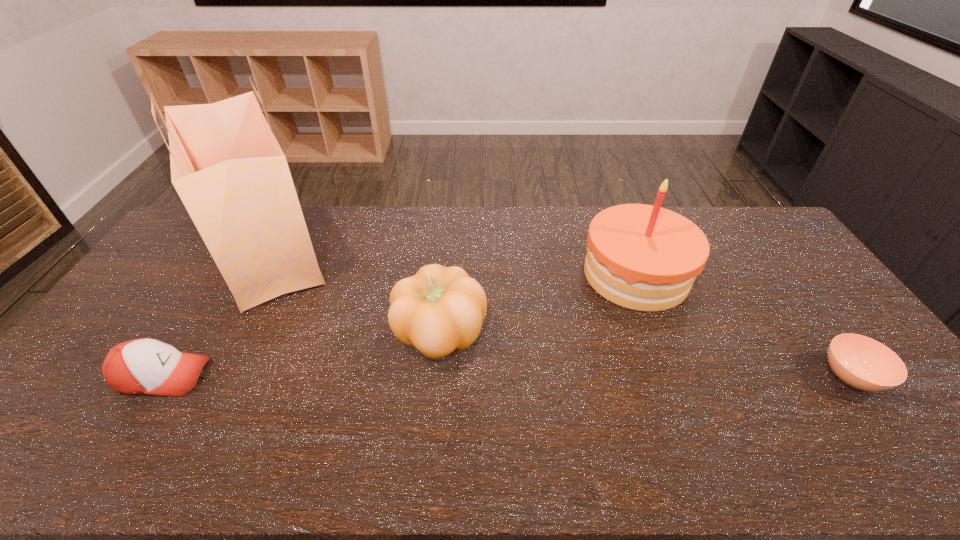
Locate an element on the screen. The image size is (960, 540). the tallest object is located at coordinates (227, 167).

The image size is (960, 540). Find the location of `birthday cake`. birthday cake is located at coordinates (642, 257).

You are a GUI agent. You are given a task and a screenshot of the screen. Output one action in this format:
    pyautogui.click(x=<x>, y=<y>)
    Task: Click on the fourth object from left to right
    Image resolution: width=960 pixels, height=540 pixels.
    Given the screenshot: What is the action you would take?
    pyautogui.click(x=642, y=257)

At what (x,y) coordinates should I click in order to perform the action: click on the third object from right to left. Please return your answer as a coordinate pair (x, y). The height and width of the screenshot is (540, 960). Looking at the image, I should click on (439, 309).

Where is `pumpkin`? The width and height of the screenshot is (960, 540). pumpkin is located at coordinates (439, 309).

Find the location of `baseball cap`. baseball cap is located at coordinates (141, 366).

You are a GUI agent. You are given a task and a screenshot of the screen. Output one action in this format:
    pyautogui.click(x=<x>, y=<y>)
    Task: Click on the soup bowl
    The height and width of the screenshot is (540, 960).
    Given the screenshot: What is the action you would take?
    pyautogui.click(x=861, y=362)

This screenshot has height=540, width=960. What are the coordinates of `the shortest object` in the screenshot? It's located at (861, 362).

In order to click on vacant space located on the side of the grocery bag with the superhero design in this screenshot , I will do `click(439, 254)`.

Find the location of a particular element. free location located on the front of the second object from right to left is located at coordinates (687, 411).